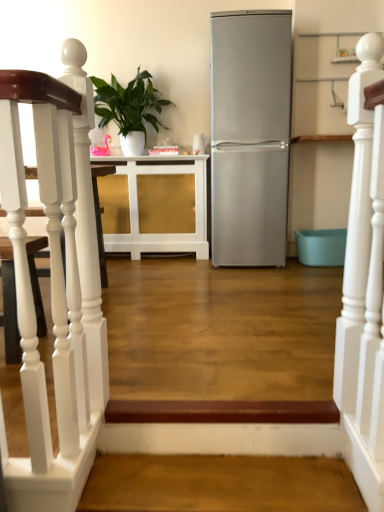
Locate an element on the screen. This screenshot has height=512, width=384. satin silver refrigerator at center is located at coordinates (250, 136).

What do you see at coordinates (250, 136) in the screenshot?
I see `satin silver refrigerator at center` at bounding box center [250, 136].

Where is `white glossy cabinet at center`? The width and height of the screenshot is (384, 512). white glossy cabinet at center is located at coordinates (157, 205).

The width and height of the screenshot is (384, 512). What do you see at coordinates (363, 290) in the screenshot? I see `white wooden railing at upper right` at bounding box center [363, 290].

What do you see at coordinates (221, 458) in the screenshot? The image size is (384, 512). I see `brown wood stairwell at lower center, which is the 2th stairwell in left-to-right order` at bounding box center [221, 458].

Where is `satin silver refrigerator at center`? The image size is (384, 512). satin silver refrigerator at center is located at coordinates (250, 136).

Which is more to the left, white wooden railing at upper right or brown wood stairwell at lower center, the first stairwell positioned from the bottom?

brown wood stairwell at lower center, the first stairwell positioned from the bottom, is more to the left.

Considering the relative sizes of white wooden railing at upper right and brown wood stairwell at lower center, the first stairwell viewed from the right, in the image provided, is white wooden railing at upper right smaller than brown wood stairwell at lower center, the first stairwell viewed from the right,?

Actually, white wooden railing at upper right might be larger than brown wood stairwell at lower center, the first stairwell viewed from the right.

Based on the photo, between white wooden railing at upper right and brown wood stairwell at lower center, the 2th stairwell when ordered from top to bottom, which one has larger width?

With larger width is brown wood stairwell at lower center, the 2th stairwell when ordered from top to bottom.

Is green glossy plant at upper center not near white wooden staircase at left, placed as the second stairwell when sorted from bottom to top?

Yes, green glossy plant at upper center and white wooden staircase at left, placed as the second stairwell when sorted from bottom to top, are located far from each other.

Find the location of a particular element. Image resolution: width=384 pixels, height=512 pixels. the 2nd stairwell in front of the green glossy plant at upper center is located at coordinates (55, 284).

Is green glossy plant at upper center facing towards white wooden staircase at left, placed as the second stairwell when sorted from bottom to top?

Yes, green glossy plant at upper center faces towards white wooden staircase at left, placed as the second stairwell when sorted from bottom to top.

Can you tell me how much white glossy cabinet at center and brown wood stairwell at lower center, the 2th stairwell when ordered from top to bottom, differ in facing direction?

The angular difference between white glossy cabinet at center and brown wood stairwell at lower center, the 2th stairwell when ordered from top to bottom, is 0.334 degrees.

Is white glossy cabinet at center outside of brown wood stairwell at lower center, the first stairwell viewed from the right?

Yes, white glossy cabinet at center is outside of brown wood stairwell at lower center, the first stairwell viewed from the right.

From a real-world perspective, between white glossy cabinet at center and brown wood stairwell at lower center, the first stairwell positioned from the bottom, who is vertically lower?

From a 3D spatial view, brown wood stairwell at lower center, the first stairwell positioned from the bottom, is below.

Does white glossy cabinet at center have a lesser width compared to brown wood stairwell at lower center, the first stairwell viewed from the right?

In fact, white glossy cabinet at center might be wider than brown wood stairwell at lower center, the first stairwell viewed from the right.

Is brown wood stairwell at lower center, the first stairwell viewed from the right, not inside white wooden staircase at left, acting as the 1th stairwell starting from the left?

brown wood stairwell at lower center, the first stairwell viewed from the right, lies outside white wooden staircase at left, acting as the 1th stairwell starting from the left,'s area.

Is there a large distance between brown wood stairwell at lower center, the first stairwell viewed from the right, and white wooden staircase at left, acting as the 1th stairwell starting from the left?

That's not correct — brown wood stairwell at lower center, the first stairwell viewed from the right, is a little close to white wooden staircase at left, acting as the 1th stairwell starting from the left.

Locate an element on the screen. The height and width of the screenshot is (512, 384). stairwell above the brown wood stairwell at lower center, the first stairwell positioned from the bottom (from the image's perspective) is located at coordinates (55, 284).

Is brown wood stairwell at lower center, which is the 2th stairwell in left-to-right order, bigger than white wooden staircase at left, which appears as the 2th stairwell when viewed from the right?

No, brown wood stairwell at lower center, which is the 2th stairwell in left-to-right order, is not bigger than white wooden staircase at left, which appears as the 2th stairwell when viewed from the right.

Is there a large distance between satin silver refrigerator at center and white glossy cabinet at center?

No, there isn't a large distance between satin silver refrigerator at center and white glossy cabinet at center.

Consider the image. Which object is further away from the camera taking this photo, satin silver refrigerator at center or white glossy cabinet at center?

white glossy cabinet at center is behind.

Is satin silver refrigerator at center not inside white glossy cabinet at center?

Yes, satin silver refrigerator at center is not within white glossy cabinet at center.

Can you confirm if satin silver refrigerator at center is positioned to the left of white glossy cabinet at center?

No.

Which is in front, satin silver refrigerator at center or green glossy plant at upper center?

satin silver refrigerator at center is in front.

Is satin silver refrigerator at center thinner than green glossy plant at upper center?

In fact, satin silver refrigerator at center might be wider than green glossy plant at upper center.

Who is smaller, satin silver refrigerator at center or green glossy plant at upper center?

green glossy plant at upper center.

Could you tell me if satin silver refrigerator at center is facing green glossy plant at upper center?

No, satin silver refrigerator at center is not aimed at green glossy plant at upper center.

From a real-world perspective, is white wooden staircase at left, acting as the 1th stairwell starting from the left, located beneath green glossy plant at upper center?

Correct, in the physical world, white wooden staircase at left, acting as the 1th stairwell starting from the left, is lower than green glossy plant at upper center.

Based on the photo, is green glossy plant at upper center located within white wooden staircase at left, which appears as the 2th stairwell when viewed from the right?

No.

Does white wooden staircase at left, placed as the second stairwell when sorted from bottom to top, turn towards green glossy plant at upper center?

No, white wooden staircase at left, placed as the second stairwell when sorted from bottom to top, does not turn towards green glossy plant at upper center.

Is white wooden staircase at left, placed as the second stairwell when sorted from bottom to top, closer to the viewer compared to green glossy plant at upper center?

Yes, the depth of white wooden staircase at left, placed as the second stairwell when sorted from bottom to top, is less than that of green glossy plant at upper center.

Locate an element on the screen. Image resolution: width=384 pixels, height=512 pixels. rail lying on the right of brown wood stairwell at lower center, which is the 2th stairwell in left-to-right order is located at coordinates (363, 290).

Where is `houseplant to the left of white wooden staircase at left, acting as the 1th stairwell starting from the top`? houseplant to the left of white wooden staircase at left, acting as the 1th stairwell starting from the top is located at coordinates (129, 109).

Which object lies nearer to the anchor point white wooden railing at upper right, satin silver refrigerator at center or white wooden staircase at left, acting as the 1th stairwell starting from the top?

white wooden staircase at left, acting as the 1th stairwell starting from the top, lies closer to white wooden railing at upper right than the other object.

Which object lies nearer to the anchor point satin silver refrigerator at center, white glossy cabinet at center or white wooden staircase at left, which appears as the 2th stairwell when viewed from the right?

The object closer to satin silver refrigerator at center is white glossy cabinet at center.

Considering their positions, is brown wood stairwell at lower center, which is the 2th stairwell in left-to-right order, positioned further to white glossy cabinet at center than white wooden staircase at left, which appears as the 2th stairwell when viewed from the right?

brown wood stairwell at lower center, which is the 2th stairwell in left-to-right order, is further to white glossy cabinet at center.

Looking at the image, which one is located further to satin silver refrigerator at center, white wooden staircase at left, which appears as the 2th stairwell when viewed from the right, or green glossy plant at upper center?

Based on the image, white wooden staircase at left, which appears as the 2th stairwell when viewed from the right, appears to be further to satin silver refrigerator at center.

Looking at the image, which one is located closer to white wooden staircase at left, acting as the 1th stairwell starting from the left, green glossy plant at upper center or white glossy cabinet at center?

Among the two, white glossy cabinet at center is located nearer to white wooden staircase at left, acting as the 1th stairwell starting from the left.

Considering their positions, is green glossy plant at upper center positioned closer to brown wood stairwell at lower center, the 2th stairwell when ordered from top to bottom, than white wooden staircase at left, acting as the 1th stairwell starting from the left?

Among the two, white wooden staircase at left, acting as the 1th stairwell starting from the left, is located nearer to brown wood stairwell at lower center, the 2th stairwell when ordered from top to bottom.

Based on their spatial positions, is brown wood stairwell at lower center, the first stairwell viewed from the right, or white wooden staircase at left, acting as the 1th stairwell starting from the top, further from white wooden railing at upper right?

white wooden staircase at left, acting as the 1th stairwell starting from the top.

Considering their positions, is white wooden staircase at left, acting as the 1th stairwell starting from the left, positioned closer to brown wood stairwell at lower center, the first stairwell viewed from the right, than green glossy plant at upper center?

white wooden staircase at left, acting as the 1th stairwell starting from the left.

I want to click on refrigerator located between white wooden staircase at left, placed as the second stairwell when sorted from bottom to top, and green glossy plant at upper center in the depth direction, so click(250, 136).

The image size is (384, 512). What are the coordinates of `stairwell between white wooden staircase at left, placed as the second stairwell when sorted from bottom to top, and green glossy plant at upper center in the front-back direction` in the screenshot? It's located at (221, 458).

The image size is (384, 512). I want to click on refrigerator between white wooden railing at upper right and green glossy plant at upper center in the front-back direction, so click(x=250, y=136).

At what (x,y) coordinates should I click in order to perform the action: click on houseplant between white wooden railing at upper right and white glossy cabinet at center along the z-axis. Please return your answer as a coordinate pair (x, y). The width and height of the screenshot is (384, 512). Looking at the image, I should click on (129, 109).